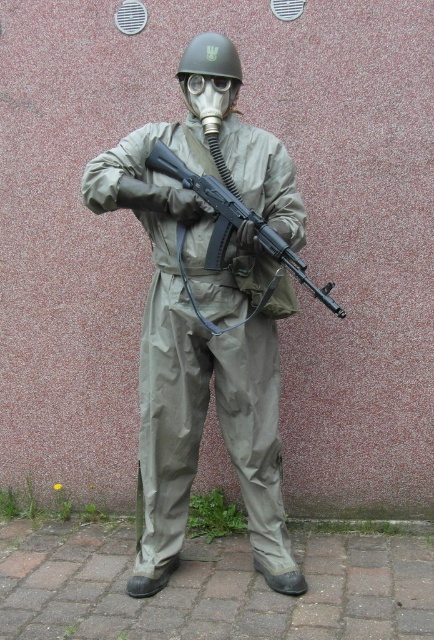
You are a military logistics officer planning to store the matte khaki uniform at center and the matte black rifle at center in a storage container. The container has a width of 7 inches. Can both items be placed side by side without overlapping?

The matte khaki uniform at center is 7.45 inches away from the matte black rifle at center, which means the total space required between them is 7.45 inches. Since the container is only 7 inches wide, they cannot be placed side by side without overlapping.

You are a soldier preparing for a mission and need to check your equipment. You have a matte black rifle at center and transparent plastic goggles at center. Which piece of equipment is on the right side?

The matte black rifle at center is positioned on the right side of the transparent plastic goggles at center, so the rifle is on the right.